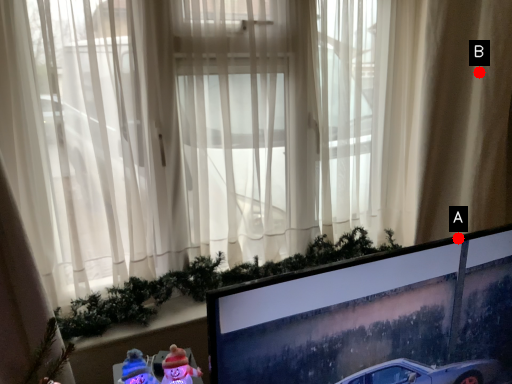
Question: Two points are circled on the image, labeled by A and B beside each circle. Which point is farther to the camera?

Choices:
 (A) A is further
 (B) B is further

Answer: (B)